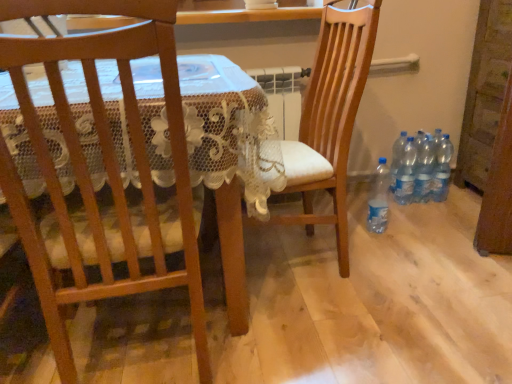
Question: Should I look upward or downward to see clear plastic bottles at lower right, the 5th bottle positioned from the left?

Choices:
 (A) up
 (B) down

Answer: (A)

Question: Does clear plastic bottles at lower right, acting as the 2th bottle starting from the right, touch clear plastic bottles at lower right, placed as the fourth bottle when sorted from right to left?

Choices:
 (A) no
 (B) yes

Answer: (A)

Question: Can you confirm if clear plastic bottles at lower right, acting as the 2th bottle starting from the right, is shorter than clear plastic bottles at lower right, the 2th bottle when ordered from left to right?

Choices:
 (A) no
 (B) yes

Answer: (A)

Question: Does clear plastic bottles at lower right, which is counted as the 4th bottle, starting from the left, have a larger size compared to clear plastic bottles at lower right, placed as the fourth bottle when sorted from right to left?

Choices:
 (A) yes
 (B) no

Answer: (A)

Question: Would you say clear plastic bottles at lower right, which is counted as the 4th bottle, starting from the left, is a long distance from clear plastic bottles at lower right, placed as the fourth bottle when sorted from right to left?

Choices:
 (A) no
 (B) yes

Answer: (A)

Question: Is clear plastic bottles at lower right, acting as the 2th bottle starting from the right, looking in the opposite direction of clear plastic bottles at lower right, the 2th bottle when ordered from left to right?

Choices:
 (A) yes
 (B) no

Answer: (B)

Question: From a real-world perspective, is clear plastic bottles at lower right, acting as the 2th bottle starting from the right, on clear plastic bottles at lower right, the 2th bottle when ordered from left to right?

Choices:
 (A) no
 (B) yes

Answer: (B)

Question: From the image's perspective, is clear plastic bottles at lower right, placed as the fourth bottle when sorted from right to left, below clear plastic bottles at lower right, the 3th bottle from the right?

Choices:
 (A) yes
 (B) no

Answer: (B)

Question: Can you confirm if clear plastic bottles at lower right, placed as the fourth bottle when sorted from right to left, is bigger than clear plastic bottles at lower right, the 3th bottle from the right?

Choices:
 (A) no
 (B) yes

Answer: (A)

Question: Can we say clear plastic bottles at lower right, placed as the fourth bottle when sorted from right to left, lies outside clear plastic bottles at lower right, the third bottle from the left?

Choices:
 (A) no
 (B) yes

Answer: (B)

Question: Is clear plastic bottles at lower right, placed as the fourth bottle when sorted from right to left, at the left side of clear plastic bottles at lower right, the third bottle from the left?

Choices:
 (A) yes
 (B) no

Answer: (A)

Question: Does clear plastic bottles at lower right, the 2th bottle when ordered from left to right, have a lesser height compared to clear plastic bottles at lower right, the third bottle from the left?

Choices:
 (A) no
 (B) yes

Answer: (B)

Question: Considering the relative sizes of clear plastic bottles at lower right, placed as the fourth bottle when sorted from right to left, and clear plastic bottles at lower right, the third bottle from the left, in the image provided, is clear plastic bottles at lower right, placed as the fourth bottle when sorted from right to left, thinner than clear plastic bottles at lower right, the third bottle from the left,?

Choices:
 (A) no
 (B) yes

Answer: (B)

Question: Is wooden chair at left, which appears as the first chair when viewed from the left, smaller than wooden chair at center, the 2th chair from the left?

Choices:
 (A) no
 (B) yes

Answer: (B)